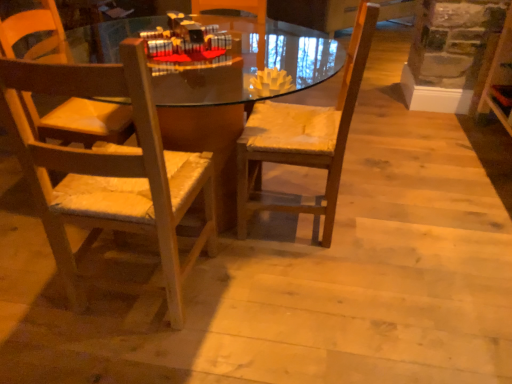
Question: Is matte wood desk at center bigger than wooden chair with woven seat cushion at left, the second chair positioned from the right?

Choices:
 (A) yes
 (B) no

Answer: (A)

Question: From a real-world perspective, does matte wood desk at center sit lower than wooden chair with woven seat cushion at left, the second chair positioned from the right?

Choices:
 (A) yes
 (B) no

Answer: (A)

Question: Is matte wood desk at center to the right of wooden chair with woven seat cushion at left, the 1th chair when ordered from left to right, from the viewer's perspective?

Choices:
 (A) no
 (B) yes

Answer: (B)

Question: Would you say matte wood desk at center is a long distance from wooden chair with woven seat cushion at left, the second chair positioned from the right?

Choices:
 (A) yes
 (B) no

Answer: (A)

Question: Is matte wood desk at center smaller than wooden chair with woven seat cushion at left, the 1th chair when ordered from left to right?

Choices:
 (A) no
 (B) yes

Answer: (A)

Question: Does matte wood desk at center come behind wooden chair with woven seat cushion at left, the second chair positioned from the right?

Choices:
 (A) yes
 (B) no

Answer: (A)

Question: Is wooden chair at center, the 1th chair from the right, closer to the viewer compared to matte wood desk at center?

Choices:
 (A) no
 (B) yes

Answer: (A)

Question: From a real-world perspective, is wooden chair at center, the 1th chair from the right, physically above matte wood desk at center?

Choices:
 (A) no
 (B) yes

Answer: (B)

Question: Is wooden chair at center, which is the 2th chair from left to right, bigger than matte wood desk at center?

Choices:
 (A) yes
 (B) no

Answer: (B)

Question: From a real-world perspective, is wooden chair at center, the 1th chair from the right, positioned under matte wood desk at center based on gravity?

Choices:
 (A) no
 (B) yes

Answer: (A)

Question: Considering the relative sizes of wooden chair at center, the 1th chair from the right, and matte wood desk at center in the image provided, is wooden chair at center, the 1th chair from the right, wider than matte wood desk at center?

Choices:
 (A) yes
 (B) no

Answer: (B)

Question: Considering the relative sizes of wooden chair at center, which is the 2th chair from left to right, and matte wood desk at center in the image provided, is wooden chair at center, which is the 2th chair from left to right, shorter than matte wood desk at center?

Choices:
 (A) no
 (B) yes

Answer: (A)

Question: Does wooden chair with woven seat cushion at left, the 1th chair when ordered from left to right, appear on the right side of wooden chair at center, the 1th chair from the right?

Choices:
 (A) no
 (B) yes

Answer: (A)